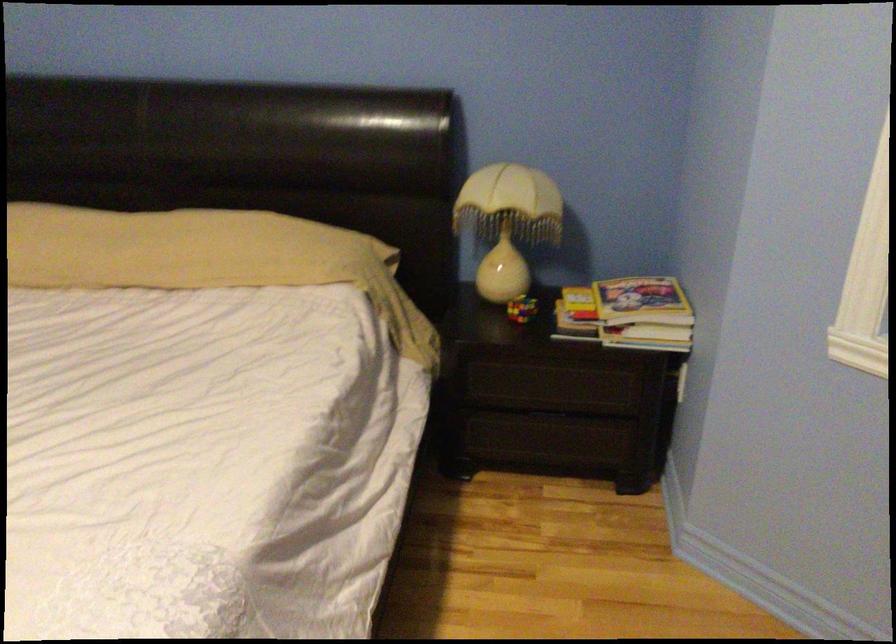
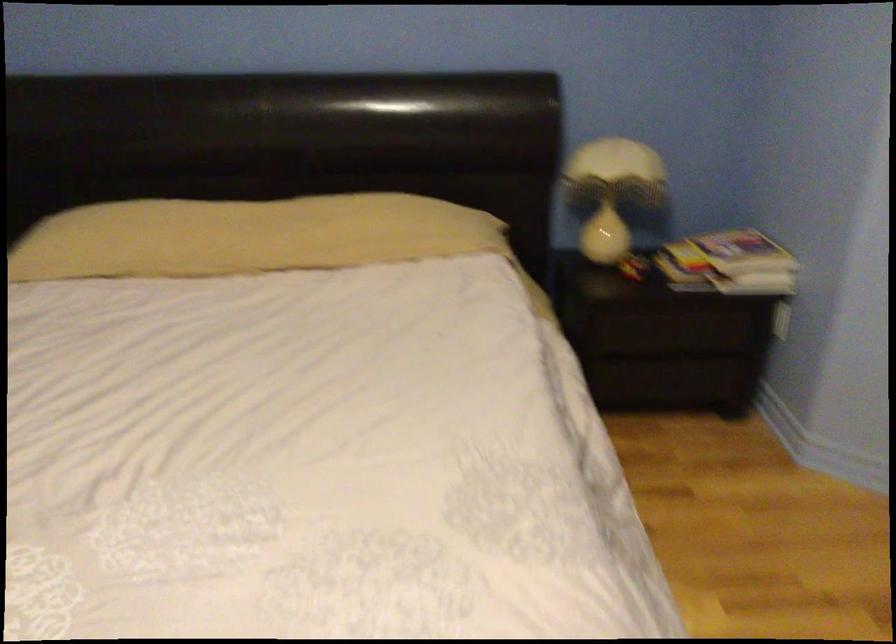
In the second image, find the point that corresponds to point 504,230 in the first image.

(613, 191)